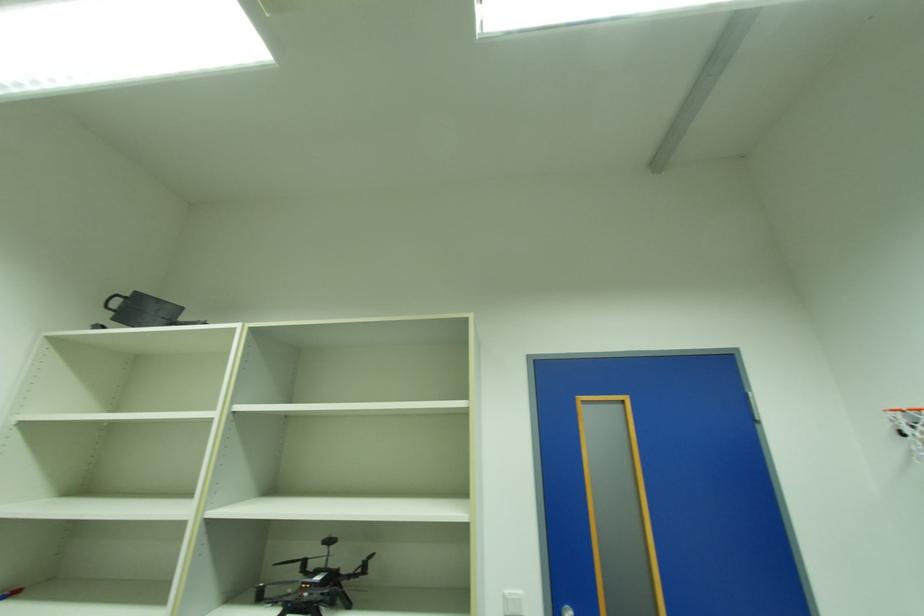
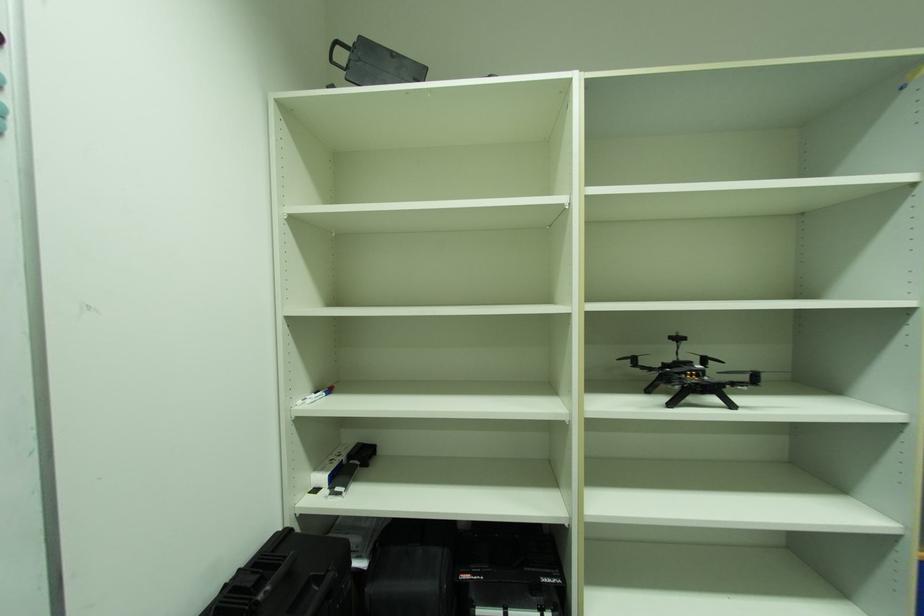
Question: The images are taken continuously from a first-person perspective. In which direction are you moving?

Choices:
 (A) Left
 (B) Right
 (C) Forward
 (D) Backward

Answer: (A)